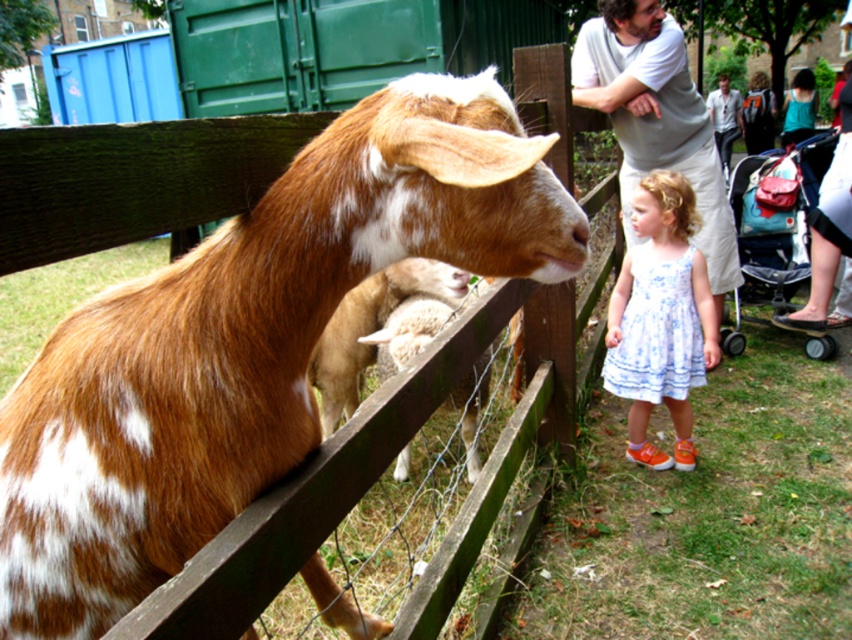
You are a photographer trying to capture a photo of the brown speckled fur at left and the white floral dress at center. Which object should you focus on first if you want to include both in your frame without moving the camera? Explain your reasoning based on their sizes.

The brown speckled fur at left is wider than the white floral dress at center. Therefore, focusing on the brown speckled fur at left first would ensure it fits within the frame since it occupies more space, allowing the white floral dress at center to be included alongside without needing to adjust the camera position.

You are a photographer trying to capture a photo of the brown speckled fur at left and the white floral dress at center. From your current position, which object is positioned lower in the frame?

The brown speckled fur at left is located below the white floral dress at center, so it is positioned lower in the frame.